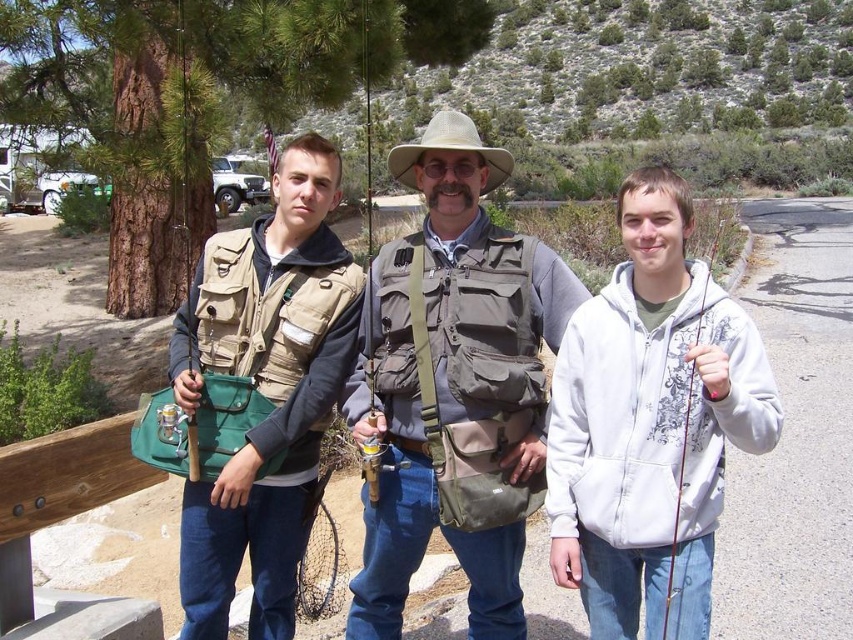
You are a photographer trying to capture both the matte khaki vest at center and the tan canvas cowboy hat at center in a single frame. Which object should you focus on first to ensure both are in the frame?

The matte khaki vest at center is smaller than the tan canvas cowboy hat at center, so you should focus on the tan canvas cowboy hat at center first to ensure both are in the frame since it takes up more space.

Based on the scene description, where is the matte khaki vest at center located in terms of coordinates?

The matte khaki vest at center is located at coordinates point (x=451, y=378).

You are a photographer taking a picture of the two central figures. You notice the matte khaki vest at center and the tan canvas cowboy hat at center. Which object appears smaller in the photo?

The matte khaki vest at center appears smaller because it has a lesser height compared to the tan canvas cowboy hat at center.